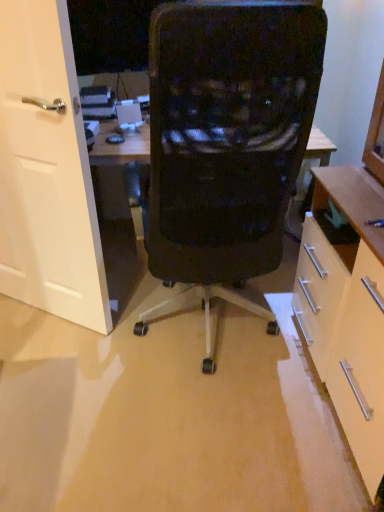
This screenshot has width=384, height=512. I want to click on vacant space that is to the left of matte white cabinet at right, so click(x=224, y=429).